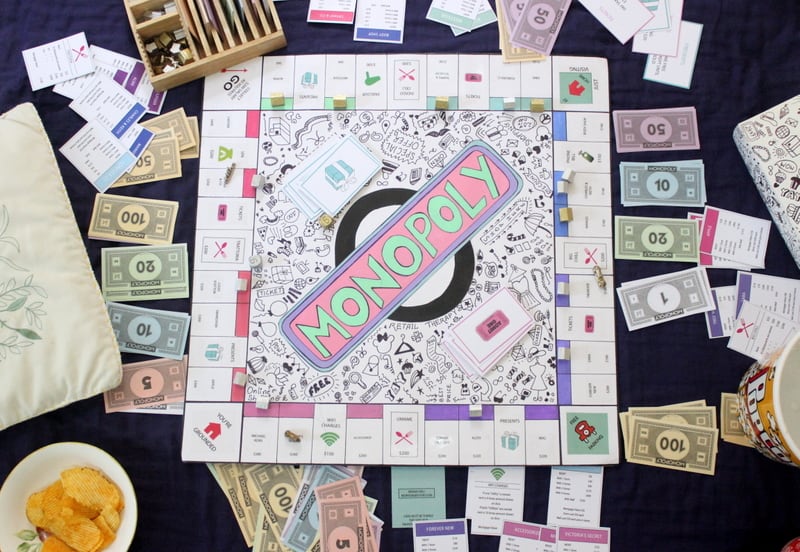
I want to click on corners, so click(589, 426), click(194, 442), click(234, 88), click(572, 82).